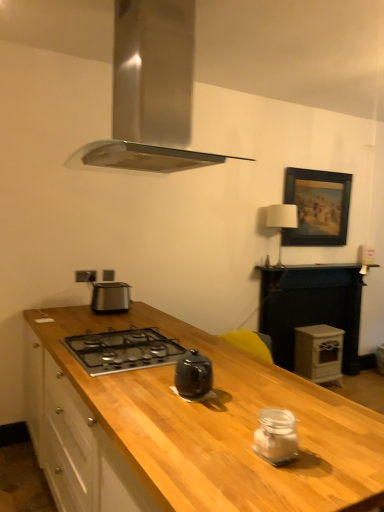
Question: From the image's perspective, is white fabric lampshade at upper right beneath wooden at right?

Choices:
 (A) no
 (B) yes

Answer: (A)

Question: Would you consider white fabric lampshade at upper right to be distant from wooden at right?

Choices:
 (A) yes
 (B) no

Answer: (B)

Question: Is white fabric lampshade at upper right at the right side of wooden at right?

Choices:
 (A) yes
 (B) no

Answer: (B)

Question: From the image's perspective, is white fabric lampshade at upper right above wooden at right?

Choices:
 (A) yes
 (B) no

Answer: (A)

Question: Is white fabric lampshade at upper right beside wooden at right?

Choices:
 (A) no
 (B) yes

Answer: (A)

Question: Can you confirm if white fabric lampshade at upper right is shorter than wooden at right?

Choices:
 (A) no
 (B) yes

Answer: (B)

Question: Considering the relative sizes of white matte wood stove at right and stainless steel range hood at upper center in the image provided, is white matte wood stove at right thinner than stainless steel range hood at upper center?

Choices:
 (A) yes
 (B) no

Answer: (A)

Question: Is white matte wood stove at right completely or partially outside of stainless steel range hood at upper center?

Choices:
 (A) yes
 (B) no

Answer: (A)

Question: Is white matte wood stove at right in contact with stainless steel range hood at upper center?

Choices:
 (A) no
 (B) yes

Answer: (A)

Question: Is white matte wood stove at right shorter than stainless steel range hood at upper center?

Choices:
 (A) no
 (B) yes

Answer: (B)

Question: Is white matte wood stove at right to the right of stainless steel range hood at upper center from the viewer's perspective?

Choices:
 (A) yes
 (B) no

Answer: (A)

Question: From the image's perspective, is white matte wood stove at right located above stainless steel range hood at upper center?

Choices:
 (A) yes
 (B) no

Answer: (B)

Question: Could you tell me if wooden at right is facing white matte wood stove at right?

Choices:
 (A) no
 (B) yes

Answer: (B)